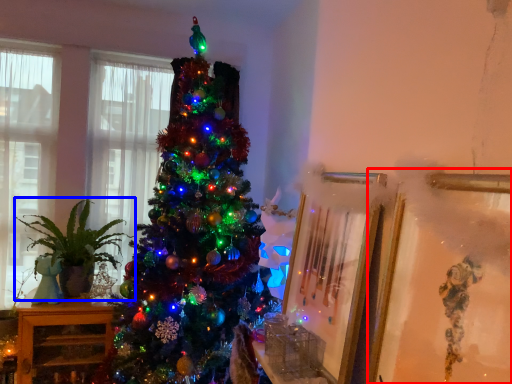
Question: Which object appears farthest to the camera in this image, picture frame (highlighted by a red box) or houseplant (highlighted by a blue box)?

Choices:
 (A) picture frame
 (B) houseplant

Answer: (B)